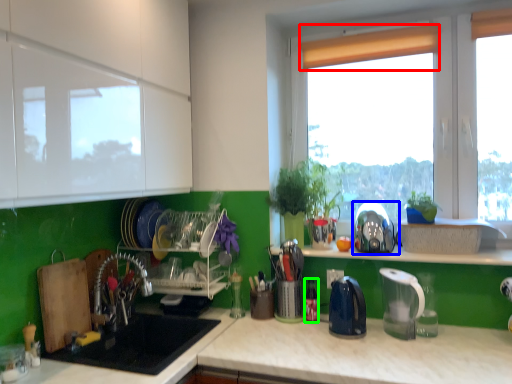
Question: Estimate the real-world distances between objects in this image. Which object is closer to curtain (highlighted by a red box), appliance (highlighted by a blue box) or bottle (highlighted by a green box)?

Choices:
 (A) appliance
 (B) bottle

Answer: (A)